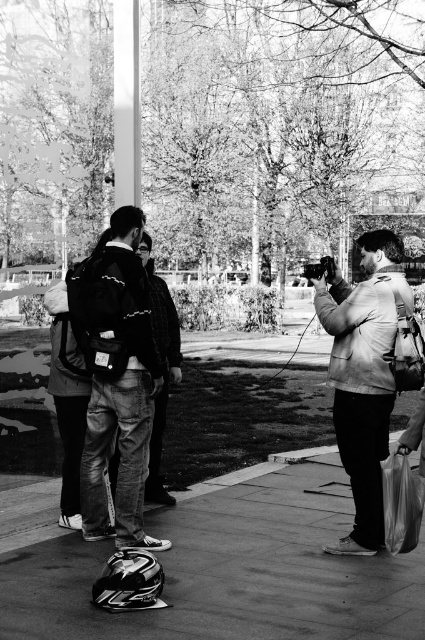
You are standing in the park and want to locate the matte beige jacket at right. According to the coordinates provided, where should you look relative to the center of the image?

The matte beige jacket at right is located at coordinates point (365,372), which means it is positioned to the right and slightly above the center of the image.

You are a photographer trying to capture a photo of the matte beige jacket at right and the dark gray jeans at center. Based on their positions in the scene, which object should you focus on first to ensure both are in the frame?

The matte beige jacket at right is much taller than the dark gray jeans at center, so you should focus on the matte beige jacket at right first to ensure both are in the frame.

You are standing at the origin point of the coordinate system. Where is the denim jacket at center located in the scene?

The denim jacket at center is located at point (x=118, y=381) in the scene.